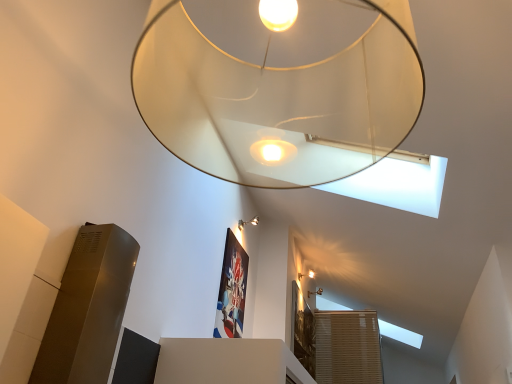
Question: From the image's perspective, is matte silver wall sconce at upper center, the third lamp ordered from the bottom, beneath matte gold wall sconce at upper right, marked as the second lamp in a back-to-front arrangement?

Choices:
 (A) no
 (B) yes

Answer: (A)

Question: Does matte silver wall sconce at upper center, the 2th lamp viewed from the top, have a smaller size compared to matte gold wall sconce at upper right, positioned as the third lamp in left-to-right order?

Choices:
 (A) no
 (B) yes

Answer: (B)

Question: Is matte silver wall sconce at upper center, the 2th lamp viewed from the top, at the left side of matte gold wall sconce at upper right, marked as the second lamp in a back-to-front arrangement?

Choices:
 (A) no
 (B) yes

Answer: (B)

Question: Is matte silver wall sconce at upper center, placed as the 4th lamp when sorted from right to left, oriented away from matte gold wall sconce at upper right, marked as the second lamp in a back-to-front arrangement?

Choices:
 (A) no
 (B) yes

Answer: (A)

Question: Is matte silver wall sconce at upper center, the third lamp ordered from the bottom, positioned behind matte gold wall sconce at upper right, acting as the third lamp starting from the top?

Choices:
 (A) no
 (B) yes

Answer: (A)

Question: From a real-world perspective, is matte silver wall sconce at upper center, arranged as the first lamp when viewed from the left, physically below matte gold wall sconce at upper right, positioned as the third lamp in left-to-right order?

Choices:
 (A) yes
 (B) no

Answer: (B)

Question: Can you confirm if matte gold wall sconce at upper right, arranged as the 3th lamp when viewed from the front, is shorter than matte silver wall sconce at upper center, the second lamp when ordered from front to back?

Choices:
 (A) yes
 (B) no

Answer: (A)

Question: Is matte silver wall sconce at upper center, the 2th lamp viewed from the top, surrounded by matte gold wall sconce at upper right, positioned as the third lamp in left-to-right order?

Choices:
 (A) yes
 (B) no

Answer: (B)

Question: From the image's perspective, is matte gold wall sconce at upper right, marked as the second lamp in a back-to-front arrangement, located above matte silver wall sconce at upper center, the second lamp when ordered from front to back?

Choices:
 (A) yes
 (B) no

Answer: (B)

Question: Is matte gold wall sconce at upper right, acting as the third lamp starting from the top, closer to camera compared to matte silver wall sconce at upper center, arranged as the first lamp when viewed from the left?

Choices:
 (A) yes
 (B) no

Answer: (B)

Question: Is matte gold wall sconce at upper right, acting as the second lamp starting from the right, wider than matte silver wall sconce at upper center, arranged as the first lamp when viewed from the left?

Choices:
 (A) no
 (B) yes

Answer: (A)

Question: Is matte gold wall sconce at upper right, acting as the third lamp starting from the top, not close to matte silver wall sconce at upper center, which ranks as the 3th lamp in back-to-front order?

Choices:
 (A) no
 (B) yes

Answer: (A)

Question: Is matte gold wall sconce at upper right, positioned as the third lamp in left-to-right order, closer to camera compared to translucent glass lampshade at upper center, the first lamp in the top-to-bottom sequence?

Choices:
 (A) no
 (B) yes

Answer: (A)